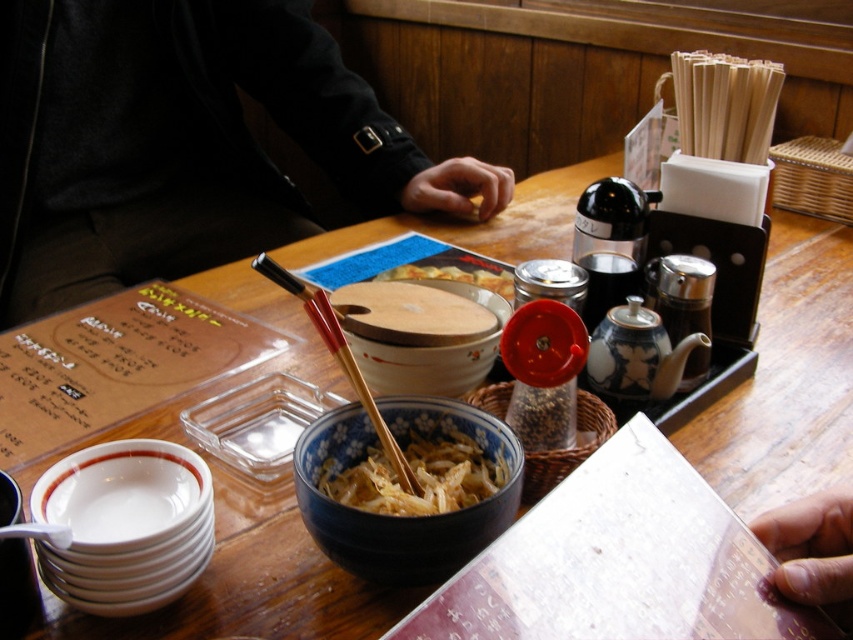
Question: Can you confirm if white glossy bowls at lower left is bigger than wooden bowl at center?

Choices:
 (A) no
 (B) yes

Answer: (A)

Question: Which object is closer to the camera taking this photo?

Choices:
 (A) dark gray sweater at upper left
 (B) matte ceramic bowl at center

Answer: (B)

Question: Does white glossy bowls at lower left have a greater width compared to finger at upper right?

Choices:
 (A) yes
 (B) no

Answer: (A)

Question: Which point is farther to the camera?

Choices:
 (A) matte ceramic bowl at center
 (B) dark gray sweater at upper left
 (C) white glossy bowls at lower left

Answer: (B)

Question: Which of the following is the farthest from the observer?

Choices:
 (A) (851, 518)
 (B) (479, 362)

Answer: (B)

Question: Can you confirm if blue ceramic bowl at center is bigger than white glossy noodles at center?

Choices:
 (A) yes
 (B) no

Answer: (A)